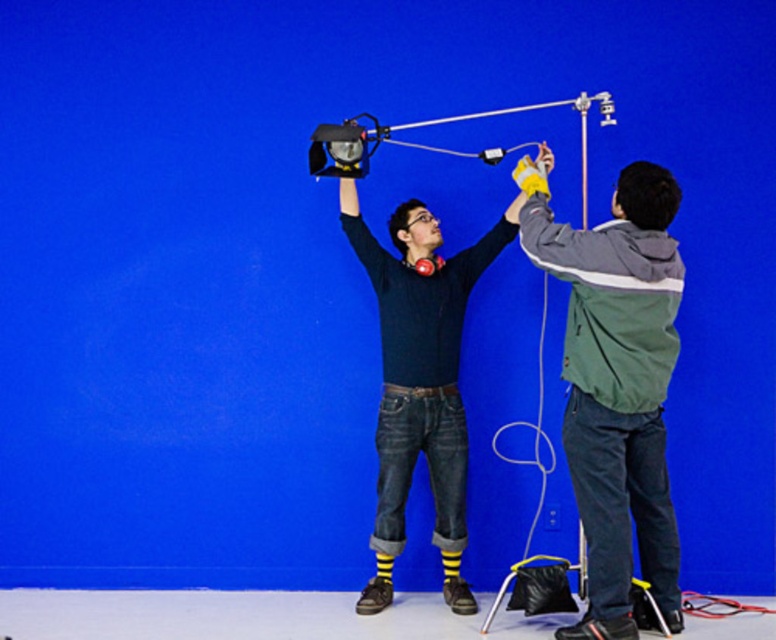
How distant is green fabric jacket at right from dark blue sweater at center?

They are 24.31 inches apart.

Who is more forward, [638,452] or [428,220]?

Point [638,452] is in front.

Image resolution: width=776 pixels, height=640 pixels. What do you see at coordinates (615, 385) in the screenshot? I see `green fabric jacket at right` at bounding box center [615, 385].

Identify the location of green fabric jacket at right. Image resolution: width=776 pixels, height=640 pixels. (615, 385).